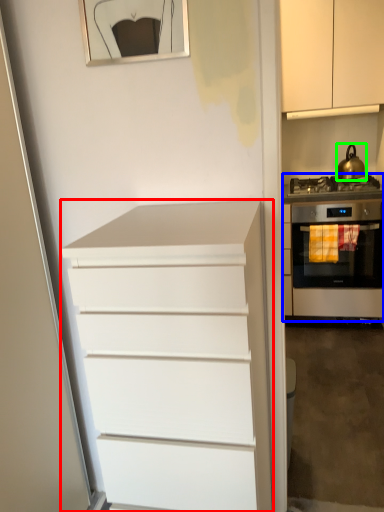
Question: Which object is positioned closest to chest of drawers (highlighted by a red box)? Select from home appliance (highlighted by a blue box) and kitchen appliance (highlighted by a green box).

Choices:
 (A) home appliance
 (B) kitchen appliance

Answer: (A)